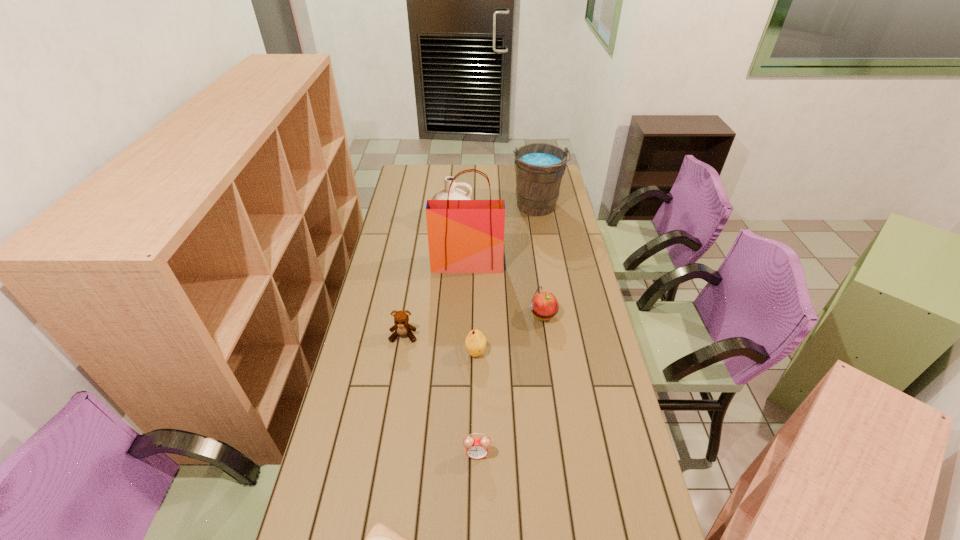
The width and height of the screenshot is (960, 540). What are the coordinates of `free space at the right edge of the desktop` in the screenshot? It's located at (558, 275).

At what (x,y) coordinates should I click in order to perform the action: click on free point between the seventh shortest object and the pear. Please return your answer as a coordinate pair (x, y). This screenshot has height=540, width=960. Looking at the image, I should click on (506, 279).

This screenshot has width=960, height=540. I want to click on blank region between the sixth shortest object and the alarm clock, so click(465, 336).

Where is `empty space that is in between the fifth nearest object and the seventh shortest object`? empty space that is in between the fifth nearest object and the seventh shortest object is located at coordinates (540, 261).

Identify which object is the closest to the teddy bear. Please provide its 2D coordinates. Your answer should be formatted as a tuple, i.e. [(x, y)], where the tuple contains the x and y coordinates of a point satisfying the conditions above.

[(475, 342)]

At what (x,y) coordinates should I click in order to perform the action: click on object that is the fifth closest one to the apple. Please return your answer as a coordinate pair (x, y). Looking at the image, I should click on (454, 194).